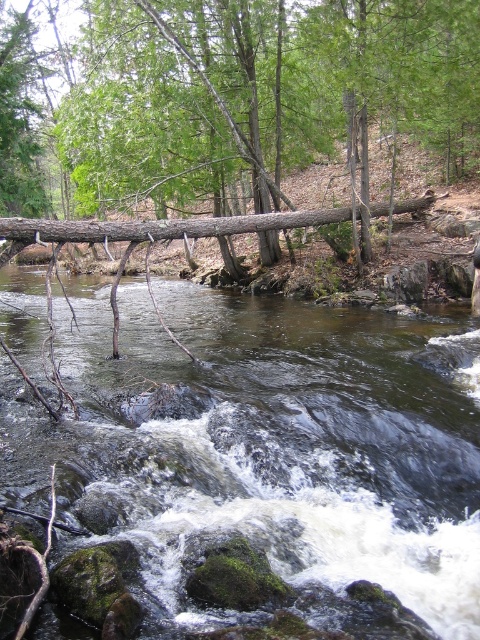
Who is taller, dark green mossy rocks at center or brown rough log at center?

brown rough log at center

In the scene shown: Can you confirm if dark green mossy rocks at center is smaller than brown rough log at center?

Correct, dark green mossy rocks at center occupies less space than brown rough log at center.

Measure the distance between dark green mossy rocks at center and camera.

They are 2.91 meters apart.

Where is `dark green mossy rocks at center`? The width and height of the screenshot is (480, 640). dark green mossy rocks at center is located at coordinates (267, 442).